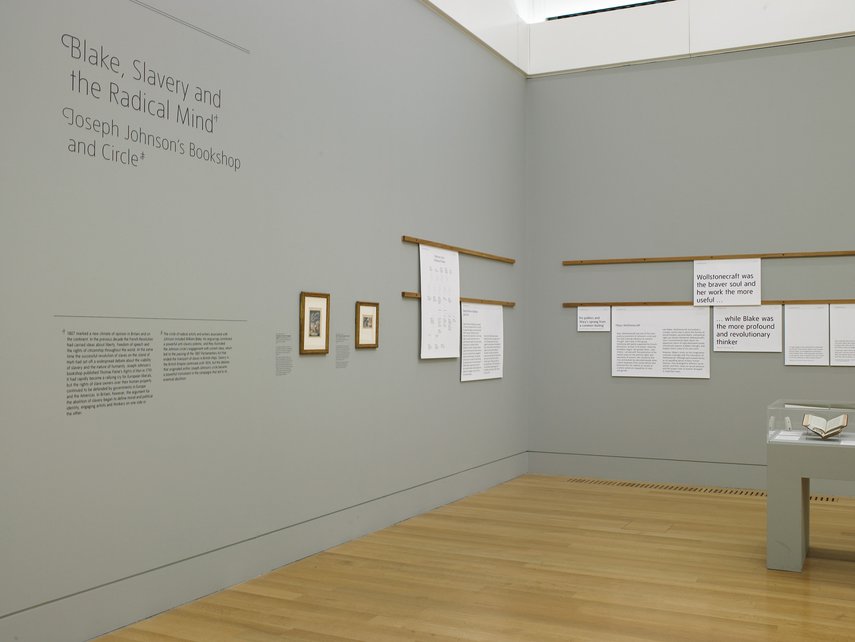
The height and width of the screenshot is (642, 855). What are the coordinates of `1 left wall` in the screenshot? It's located at (201, 223).